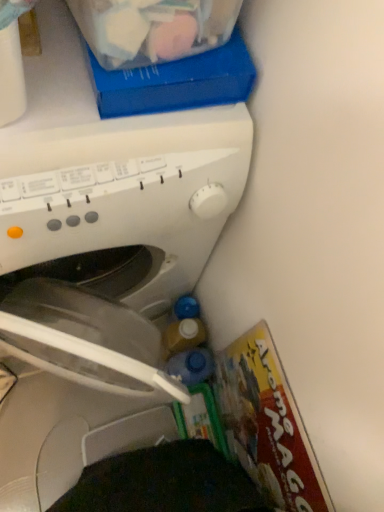
Question: In terms of size, does translucent plastic storage box at upper center appear bigger or smaller than matte cardboard magazine at lower right?

Choices:
 (A) big
 (B) small

Answer: (A)

Question: From their relative heights in the image, would you say translucent plastic storage box at upper center is taller or shorter than matte cardboard magazine at lower right?

Choices:
 (A) short
 (B) tall

Answer: (A)

Question: Based on their relative distances, which object is farther from the white plastic washing machine at center?

Choices:
 (A) blue translucent bottle at lower right
 (B) matte cardboard magazine at lower right
 (C) translucent plastic storage box at upper center

Answer: (A)

Question: Which of these objects is positioned farthest from the matte cardboard magazine at lower right?

Choices:
 (A) white plastic washing machine at center
 (B) translucent plastic storage box at upper center
 (C) blue translucent bottle at lower right

Answer: (B)